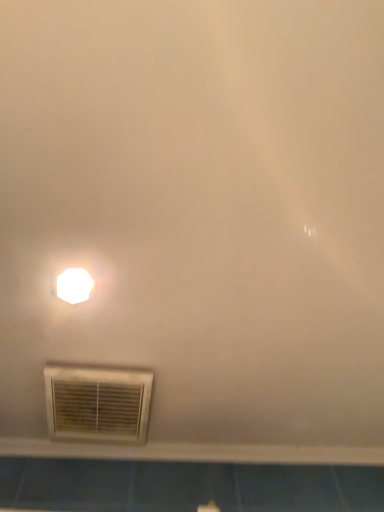
Question: Is white plastic window sill at lower center in front of or behind white glossy light fixture at upper left in the image?

Choices:
 (A) front
 (B) behind

Answer: (B)

Question: Considering the relative positions of white plastic window sill at lower center and white glossy light fixture at upper left in the image provided, is white plastic window sill at lower center to the left or to the right of white glossy light fixture at upper left?

Choices:
 (A) left
 (B) right

Answer: (B)

Question: Which object is positioned farthest from the white plastic window sill at lower center?

Choices:
 (A) white glossy light fixture at upper left
 (B) white plastic air conditioning at lower left

Answer: (A)

Question: Which object is positioned closest to the white plastic window sill at lower center?

Choices:
 (A) white glossy light fixture at upper left
 (B) white plastic air conditioning at lower left

Answer: (B)